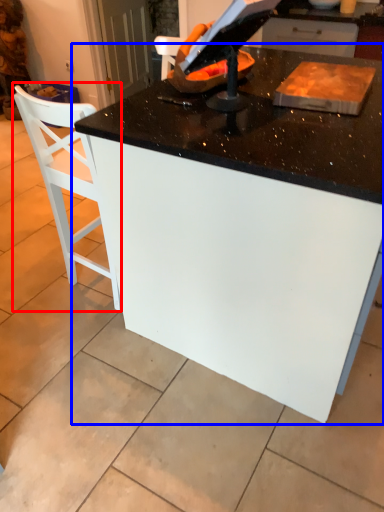
Question: Among these objects, which one is nearest to the camera, chair (highlighted by a red box) or table (highlighted by a blue box)?

Choices:
 (A) chair
 (B) table

Answer: (B)